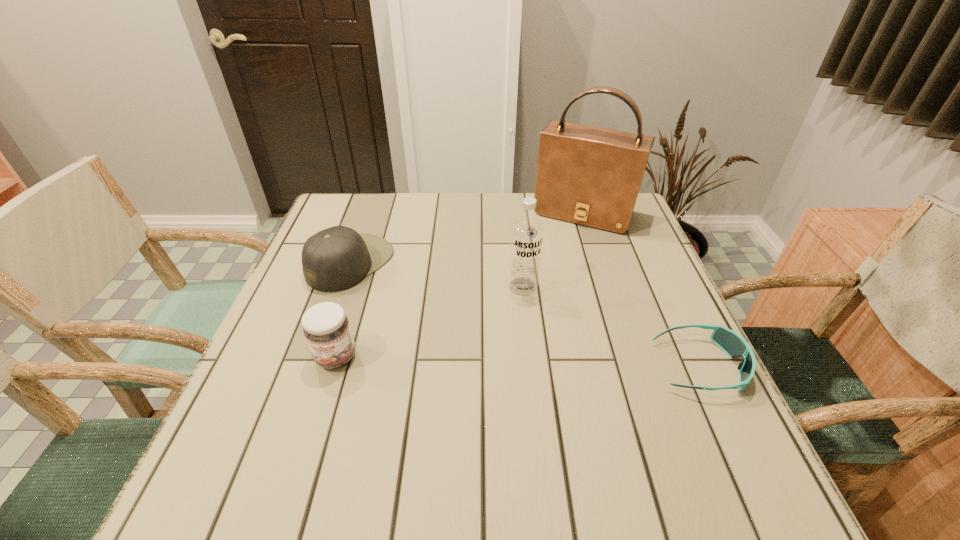
You are a GUI agent. You are given a task and a screenshot of the screen. Output one action in this format:
    pyautogui.click(x=<x>, y=<y>)
    Task: Click on the jam
    This screenshot has width=960, height=540.
    Given the screenshot: What is the action you would take?
    pyautogui.click(x=326, y=328)

This screenshot has height=540, width=960. What are the coordinates of `sunglasses` in the screenshot? It's located at (735, 346).

Find the location of a particular element. Image resolution: width=960 pixels, height=540 pixels. shoulder bag is located at coordinates (587, 175).

Locate an element on the screen. Image resolution: width=960 pixels, height=540 pixels. the fourth shortest object is located at coordinates (526, 237).

Find the location of a particular element. The image size is (960, 540). vodka is located at coordinates (526, 237).

Identify the location of cap. (337, 258).

Locate an element on the screen. The image size is (960, 540). free space located 0.130m on the front label of the jam is located at coordinates (312, 435).

This screenshot has height=540, width=960. Identify the location of free space located 0.300m on the front flap of the shoulder bag. (535, 303).

In order to click on free location located 0.220m on the front flap of the shoulder bag in this screenshot , I will do `click(545, 282)`.

Where is `vacant space located 0.140m on the front flap of the shoulder bag`? vacant space located 0.140m on the front flap of the shoulder bag is located at coordinates (554, 263).